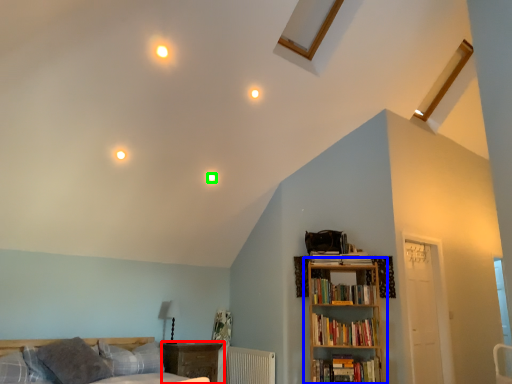
Question: Which object is the farthest from nightstand (highlighted by a red box)? Choose among these: bookcase (highlighted by a blue box) or lighting (highlighted by a green box).

Choices:
 (A) bookcase
 (B) lighting

Answer: (B)